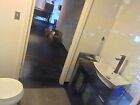
Locate an element on the screen. This screenshot has width=140, height=105. wall above sink is located at coordinates (126, 27).